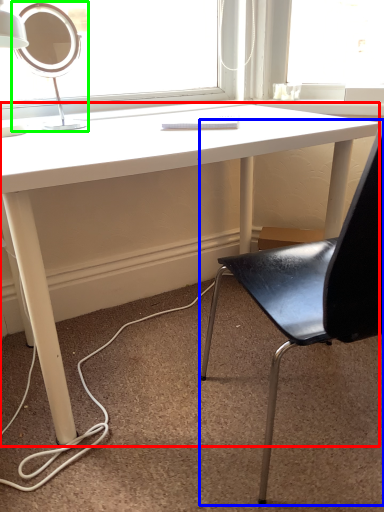
Question: Which object is the farthest from desk (highlighted by a red box)? Choose among these: chair (highlighted by a blue box) or table lamp (highlighted by a green box).

Choices:
 (A) chair
 (B) table lamp

Answer: (A)